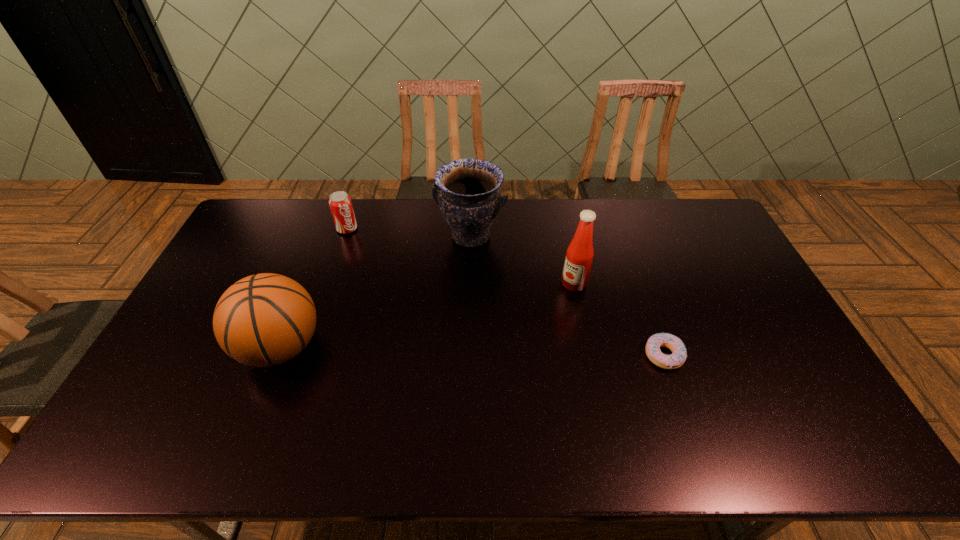
Find the location of `unoccupied position between the basketball and the fourth tallest object`. unoccupied position between the basketball and the fourth tallest object is located at coordinates 314,288.

I want to click on free space between the second shortest object and the fourth object from left to right, so click(461, 256).

Locate an element on the screen. This screenshot has height=540, width=960. free space between the basketball and the second object from right to left is located at coordinates (427, 315).

The height and width of the screenshot is (540, 960). Identify the location of free space between the basketball and the pottery. click(375, 292).

I want to click on vacant area that lies between the basketball and the rightmost object, so click(x=472, y=351).

Identify the location of blank region between the doughnut and the pottery. (567, 296).

Image resolution: width=960 pixels, height=540 pixels. I want to click on free space between the condiment and the basketball, so click(427, 315).

Identify which object is the closest to the third object from right to left. Please provide its 2D coordinates. Your answer should be formatted as a tuple, i.e. [(x, y)], where the tuple contains the x and y coordinates of a point satisfying the conditions above.

[(579, 256)]

Where is `object that is the third nearest to the soda can`? object that is the third nearest to the soda can is located at coordinates (579, 256).

Find the location of `free location that satisfies the following two spatial constraints: 1. on the front side of the pottery; 2. on the left side of the soda can`. free location that satisfies the following two spatial constraints: 1. on the front side of the pottery; 2. on the left side of the soda can is located at coordinates (345, 237).